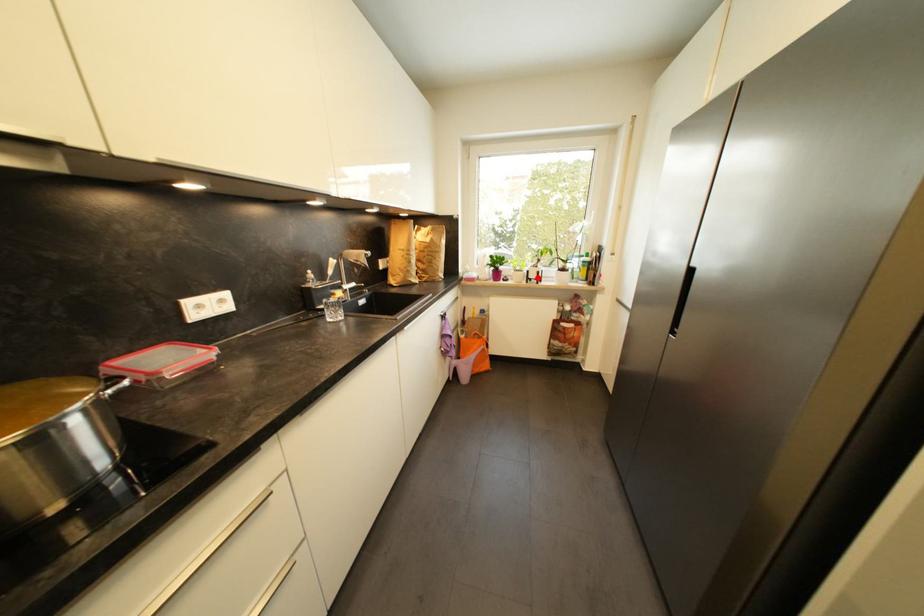
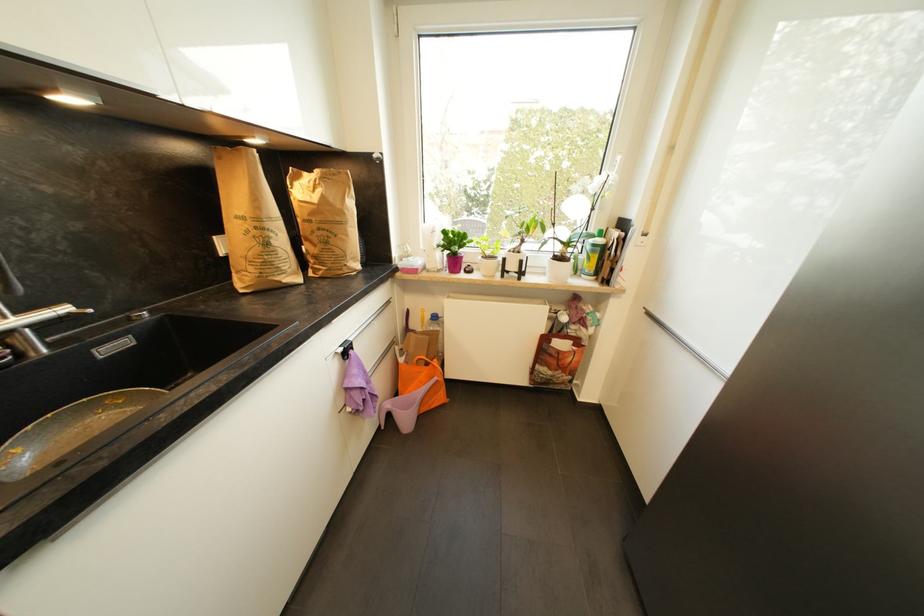
In the second image, find the point that corresponds to the highlighted location in the first image.

(517, 268)